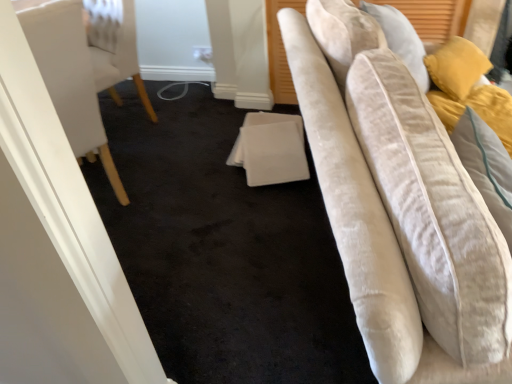
Question: Is white fabric at center far away from velvet beige chair at left?

Choices:
 (A) no
 (B) yes

Answer: (A)

Question: From a real-world perspective, is white fabric at center over velvet beige chair at left?

Choices:
 (A) yes
 (B) no

Answer: (B)

Question: Is white fabric at center thinner than velvet beige chair at left?

Choices:
 (A) yes
 (B) no

Answer: (A)

Question: Is white fabric at center bigger than velvet beige chair at left?

Choices:
 (A) yes
 (B) no

Answer: (B)

Question: Are white fabric at center and velvet beige chair at left making contact?

Choices:
 (A) no
 (B) yes

Answer: (A)

Question: Can you confirm if white fabric at center is wider than velvet beige chair at left?

Choices:
 (A) no
 (B) yes

Answer: (A)

Question: Is velvet beige chair at left positioned behind white fabric at center?

Choices:
 (A) yes
 (B) no

Answer: (B)

Question: Is velvet beige chair at left positioned before white fabric at center?

Choices:
 (A) no
 (B) yes

Answer: (B)

Question: Is velvet beige chair at left oriented towards white fabric at center?

Choices:
 (A) no
 (B) yes

Answer: (A)

Question: Does velvet beige chair at left have a smaller size compared to white fabric at center?

Choices:
 (A) no
 (B) yes

Answer: (A)

Question: Is velvet beige chair at left facing away from white fabric at center?

Choices:
 (A) no
 (B) yes

Answer: (A)

Question: Does velvet beige chair at left have a greater height compared to white fabric at center?

Choices:
 (A) no
 (B) yes

Answer: (B)

Question: Considering the positions of white fabric at center and velvet beige chair at left in the image, is white fabric at center wider or thinner than velvet beige chair at left?

Choices:
 (A) thin
 (B) wide

Answer: (A)